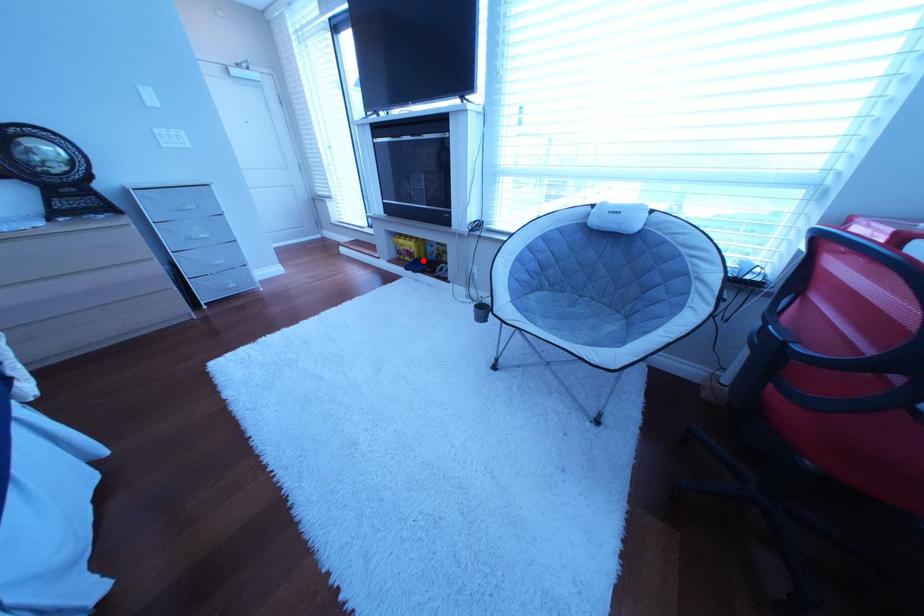
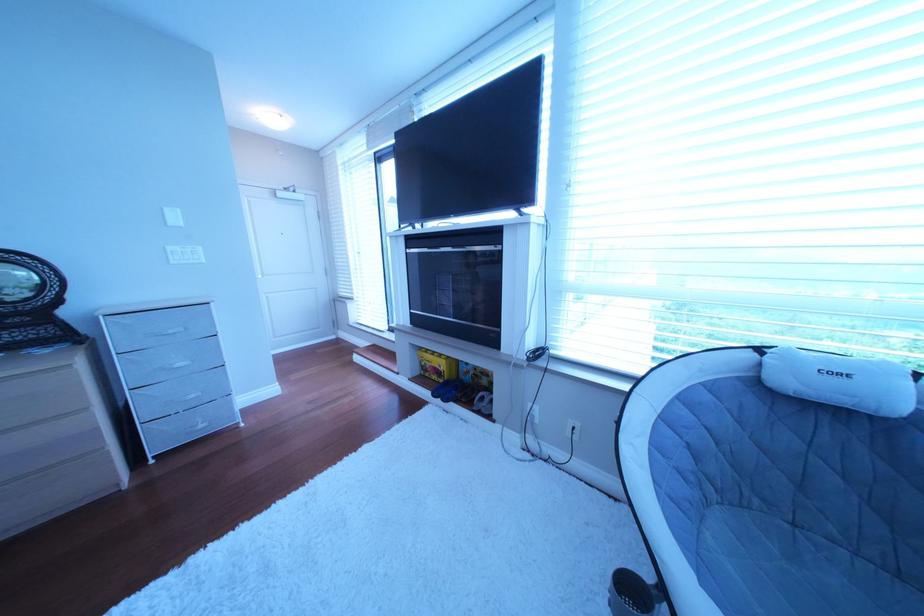
Question: I am providing you with two images of the same scene from different viewpoints. A red point is marked on the first image. Can you still see the location of the red point in image 2?

Choices:
 (A) Yes
 (B) No

Answer: (A)